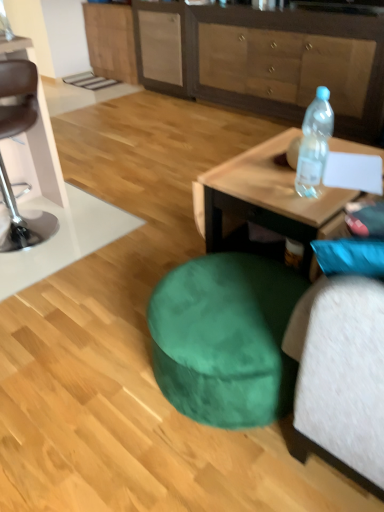
This screenshot has width=384, height=512. In order to click on vacant space that's between velvet green bean bag at lower center and brown leather bar stool at left in this screenshot , I will do `click(100, 273)`.